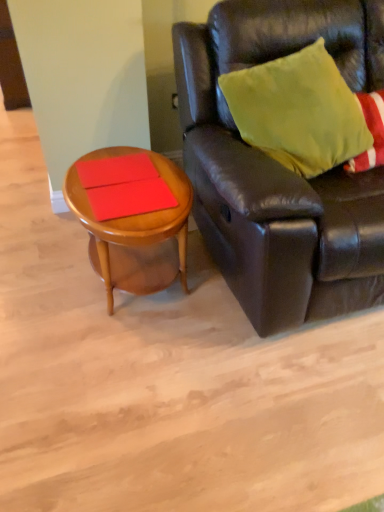
Image resolution: width=384 pixels, height=512 pixels. In order to click on empty space that is ontop of woodenobject at left in this screenshot , I will do `click(120, 188)`.